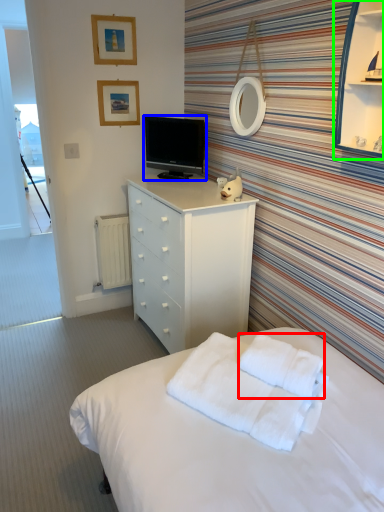
Question: Considering the real-world distances, which object is closest to cloth (highlighted by a red box)? television (highlighted by a blue box) or cabinet (highlighted by a green box).

Choices:
 (A) television
 (B) cabinet

Answer: (B)